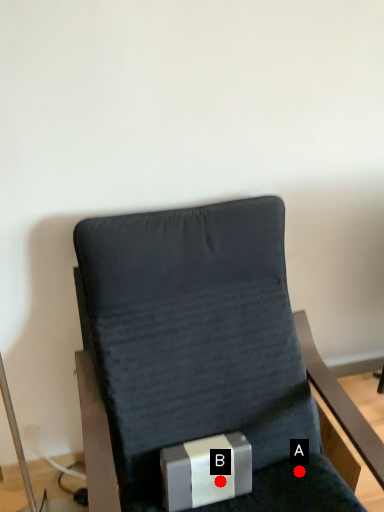
Question: Two points are circled on the image, labeled by A and B beside each circle. Among these points, which one is farthest from the camera?

Choices:
 (A) A is further
 (B) B is further

Answer: (A)